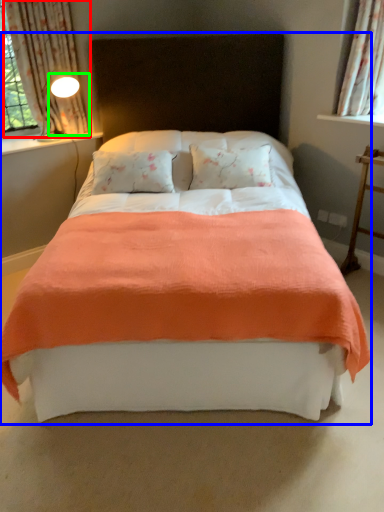
Question: Based on their relative distances, which object is nearer to curtain (highlighted by a red box)? Choose from bed (highlighted by a blue box) and light fixture (highlighted by a green box).

Choices:
 (A) bed
 (B) light fixture

Answer: (B)